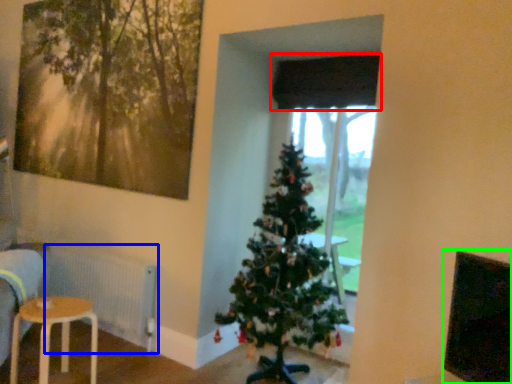
Question: Which object is positioned farthest from curtain (highlighted by a red box)? Select from radiator (highlighted by a blue box) and window screen (highlighted by a green box).

Choices:
 (A) radiator
 (B) window screen

Answer: (A)